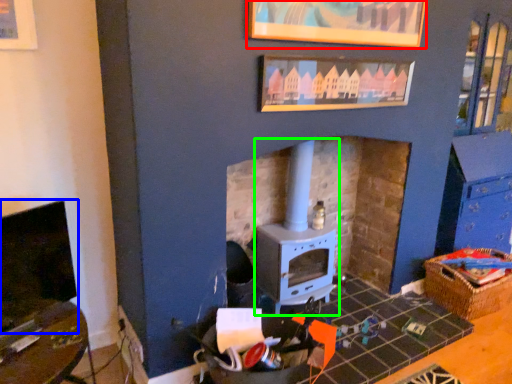
Question: Which object is positioned closest to picture frame (highlighted by a red box)? Select from fireplace (highlighted by a blue box) and wood burning stove (highlighted by a green box).

Choices:
 (A) fireplace
 (B) wood burning stove

Answer: (B)